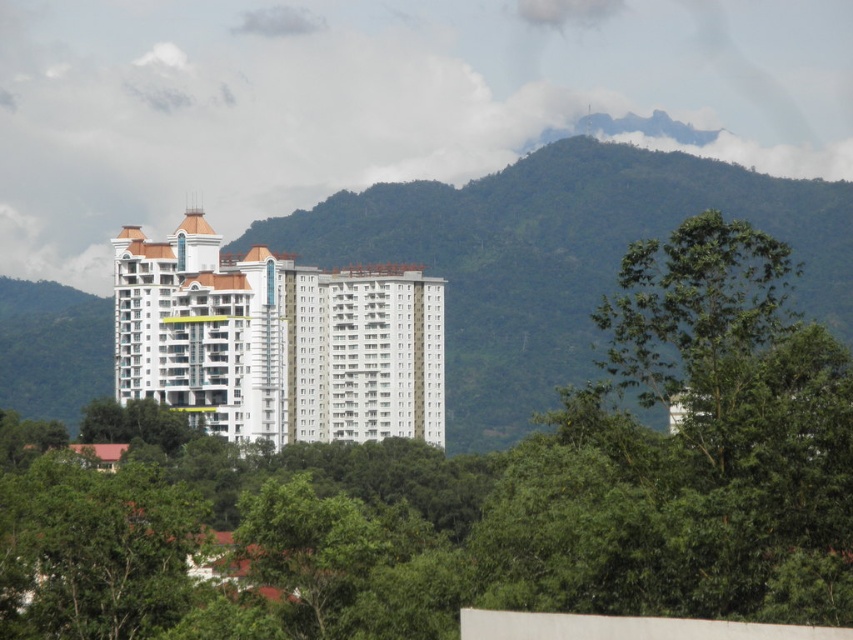
You are standing in front of the modern highrise building and see two points marked on the building facade. The first point is at coordinates point [811,449] and the second is at point [741,301]. Which point is closer to you?

Point [811,449] is closer to the viewer than point [741,301].

You are standing at the base of the mountain looking at the residential building. There are two points marked on the building facade. The first point is at coordinate point[480,493] and the second is at point[57,403]. From your vantage point, which point is closer to you?

Point[480,493] is in front of point[57,403], so the first point is closer to you.